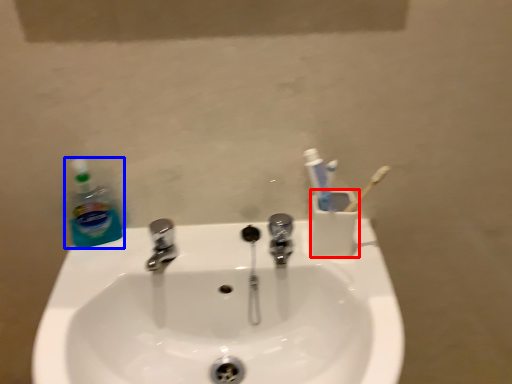
Question: Which point is closer to the camera, liquid (highlighted by a red box) or cleaning product (highlighted by a blue box)?

Choices:
 (A) liquid
 (B) cleaning product

Answer: (A)